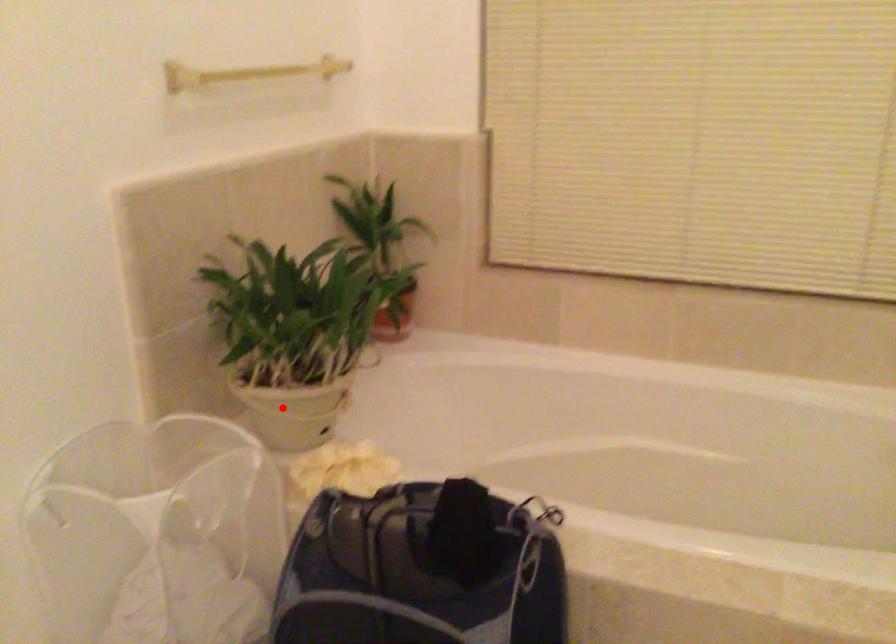
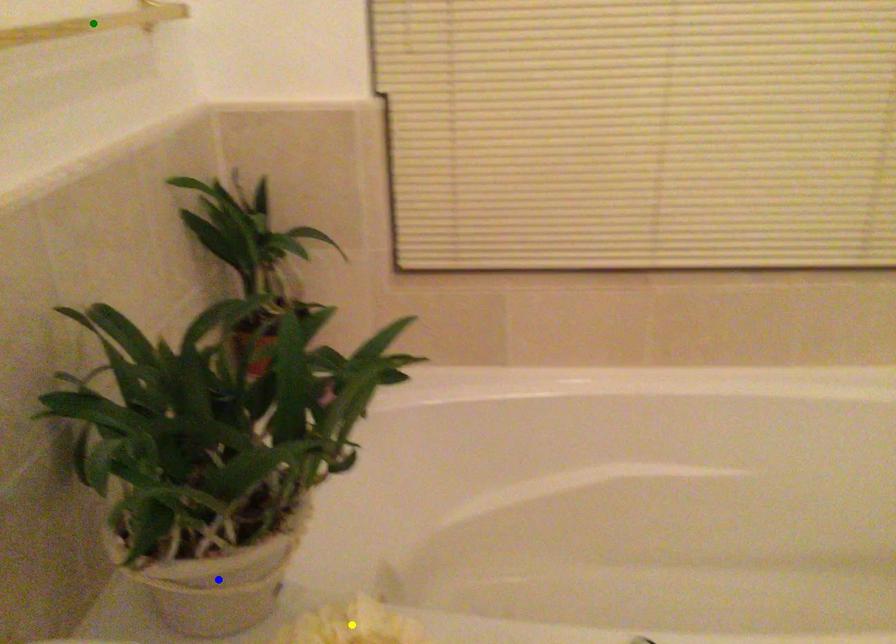
Question: I am providing you with two images of the same scene from different viewpoints. A red point is marked on the first image. You are given multiple points on the second image. Can you choose the point in image 2 that corresponds to the point in image 1?

Choices:
 (A) blue point
 (B) yellow point
 (C) green point

Answer: (A)